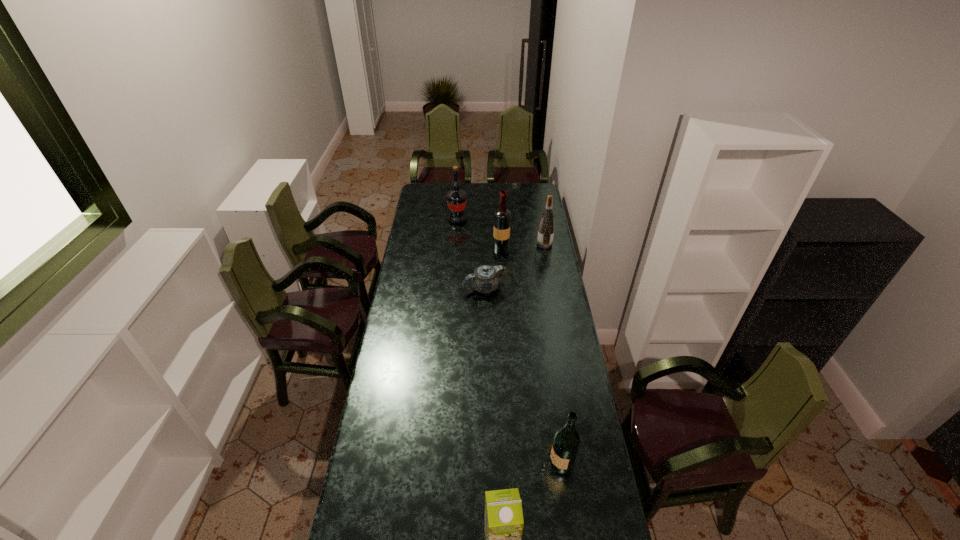
The height and width of the screenshot is (540, 960). In order to click on the third wine bottle from right to left in this screenshot , I will do `click(502, 216)`.

This screenshot has height=540, width=960. What are the coordinates of `the farthest object` in the screenshot? It's located at [456, 198].

Locate an element on the screen. This screenshot has width=960, height=540. the farthest wine bottle is located at coordinates (456, 198).

Locate an element on the screen. the nearest wine bottle is located at coordinates (566, 442).

You are a GUI agent. You are given a task and a screenshot of the screen. Output one action in this format:
    pyautogui.click(x=<x>, y=<y>)
    Task: Click on the third nearest object
    
    Given the screenshot: What is the action you would take?
    pyautogui.click(x=486, y=278)

Image resolution: width=960 pixels, height=540 pixels. I want to click on chinaware, so click(486, 278).

The image size is (960, 540). What are the coordinates of `free point located 0.250m on the front of the second wine bottle from left to right` in the screenshot? It's located at (503, 286).

Find the location of a particular element. free space located on the front of the farthest wine bottle is located at coordinates (456, 237).

At what (x,y) coordinates should I click in order to perform the action: click on blank space located 0.160m on the left of the fifth farthest object. Please return your answer as a coordinate pair (x, y). The width and height of the screenshot is (960, 540). Looking at the image, I should click on pos(492,461).

Image resolution: width=960 pixels, height=540 pixels. Identify the location of vacant space located 0.060m from the spout of the chinaware. (451, 288).